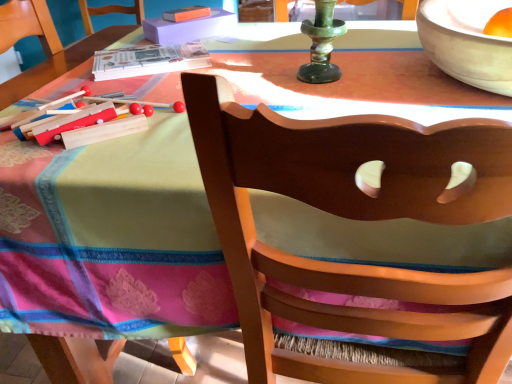
Question: Considering the relative sizes of orange matte chair at upper left and wooden chair at center in the image provided, is orange matte chair at upper left thinner than wooden chair at center?

Choices:
 (A) no
 (B) yes

Answer: (B)

Question: Does orange matte chair at upper left come in front of wooden chair at center?

Choices:
 (A) yes
 (B) no

Answer: (B)

Question: Is orange matte chair at upper left shorter than wooden chair at center?

Choices:
 (A) no
 (B) yes

Answer: (B)

Question: From a real-world perspective, is orange matte chair at upper left over wooden chair at center?

Choices:
 (A) no
 (B) yes

Answer: (B)

Question: Could wooden chair at center be considered to be inside orange matte chair at upper left?

Choices:
 (A) yes
 (B) no

Answer: (B)

Question: From the image's perspective, is orange matte chair at upper left below wooden chair at center?

Choices:
 (A) no
 (B) yes

Answer: (A)

Question: Can you confirm if wooden chair at center is thinner than orange matte chair at upper left?

Choices:
 (A) no
 (B) yes

Answer: (A)

Question: From the image's perspective, is wooden chair at center above orange matte chair at upper left?

Choices:
 (A) no
 (B) yes

Answer: (A)

Question: Considering the relative positions of wooden chair at center and orange matte chair at upper left in the image provided, is wooden chair at center to the left of orange matte chair at upper left from the viewer's perspective?

Choices:
 (A) yes
 (B) no

Answer: (B)

Question: Is wooden chair at center positioned before orange matte chair at upper left?

Choices:
 (A) no
 (B) yes

Answer: (B)

Question: Would you say wooden chair at center is outside orange matte chair at upper left?

Choices:
 (A) no
 (B) yes

Answer: (B)

Question: Is wooden chair at center further to the viewer compared to orange matte chair at upper left?

Choices:
 (A) no
 (B) yes

Answer: (A)

Question: Considering the positions of wooden chair at center and orange matte chair at upper left in the image, is wooden chair at center taller or shorter than orange matte chair at upper left?

Choices:
 (A) tall
 (B) short

Answer: (A)